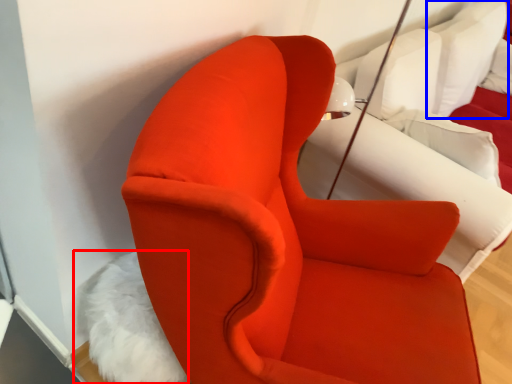
Question: Among these objects, which one is nearest to the camera, animal (highlighted by a red box) or pillow (highlighted by a blue box)?

Choices:
 (A) animal
 (B) pillow

Answer: (A)